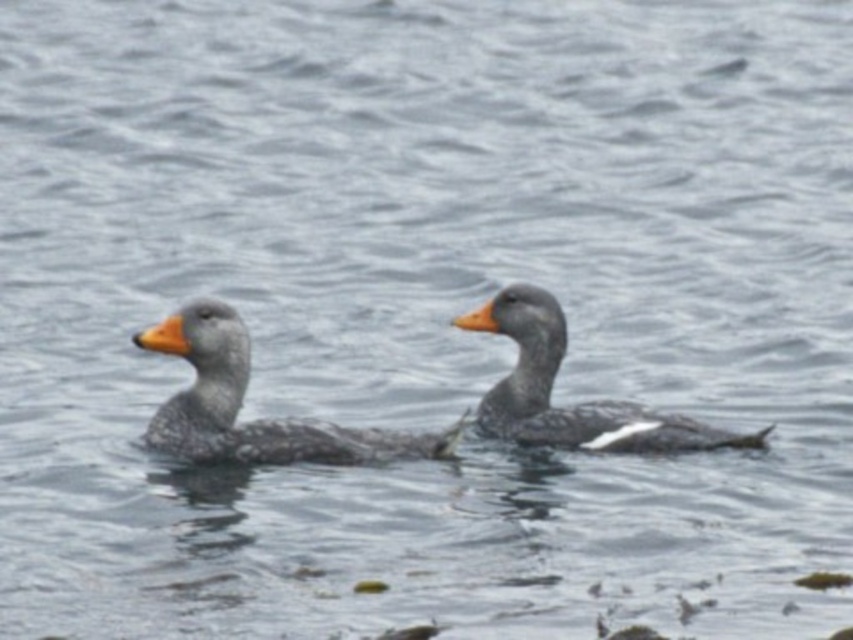
You are standing at the edge of the water and see two points on the water surface labeled as point (x=161, y=406) and point (x=576, y=404). Which point is nearer to you?

Point (x=161, y=406) is closer to the viewer than point (x=576, y=404).

You are a wildlife photographer aiming to capture both the gray speckled duck at center and the gray matte duck at center in a single frame. Given their sizes, which duck would you need to position closer to the camera to ensure both fit in the frame?

Since the gray speckled duck at center is larger in width than the gray matte duck at center, you should position the smaller gray matte duck at center closer to the camera to balance their sizes in the frame.

You are observing two ducks in the water. You notice that the gray speckled duck at center and the gray matte duck at center are positioned in such a way that one is nearer to you. Which duck is closer to you?

The gray speckled duck at center is closer to the viewer than the gray matte duck at center.